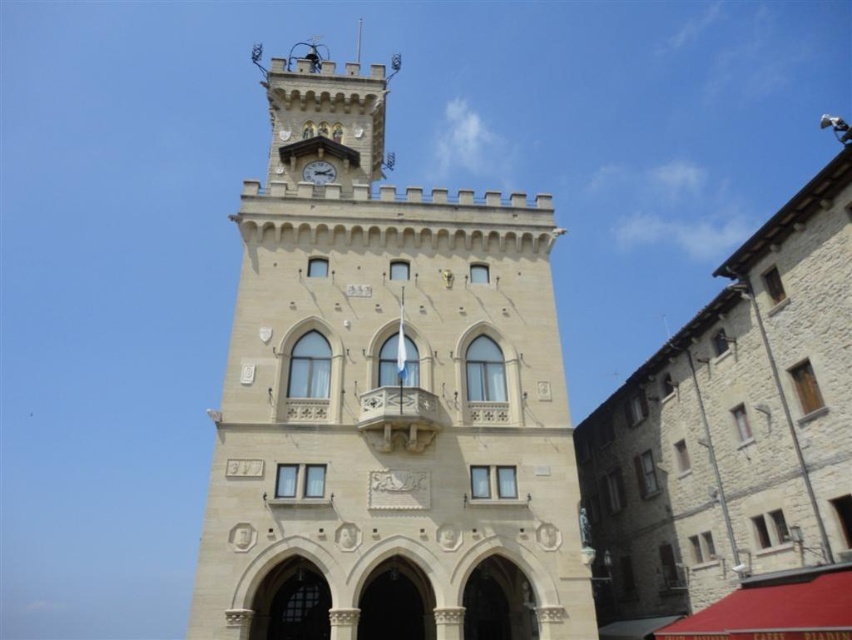
Is point (553, 595) closer to viewer compared to point (334, 172)?

Yes.

Which is in front, point (375, 202) or point (327, 180)?

Point (375, 202)

Where is `beige stone clock tower at center`? This screenshot has height=640, width=852. beige stone clock tower at center is located at coordinates (386, 400).

Locate an element on the screen. This screenshot has height=640, width=852. beige stone clock tower at center is located at coordinates (386, 400).